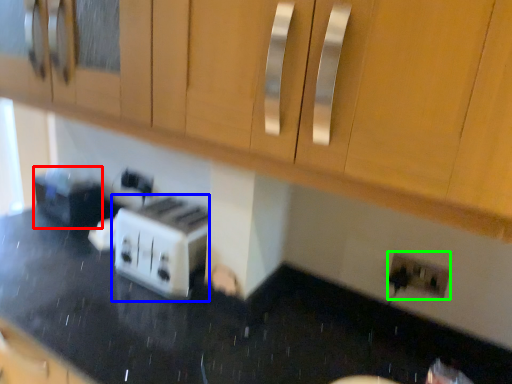
Question: Based on their relative distances, which object is nearer to appliance (highlighted by a red box)? Choose from toaster (highlighted by a blue box) and electric outlet (highlighted by a green box).

Choices:
 (A) toaster
 (B) electric outlet

Answer: (A)